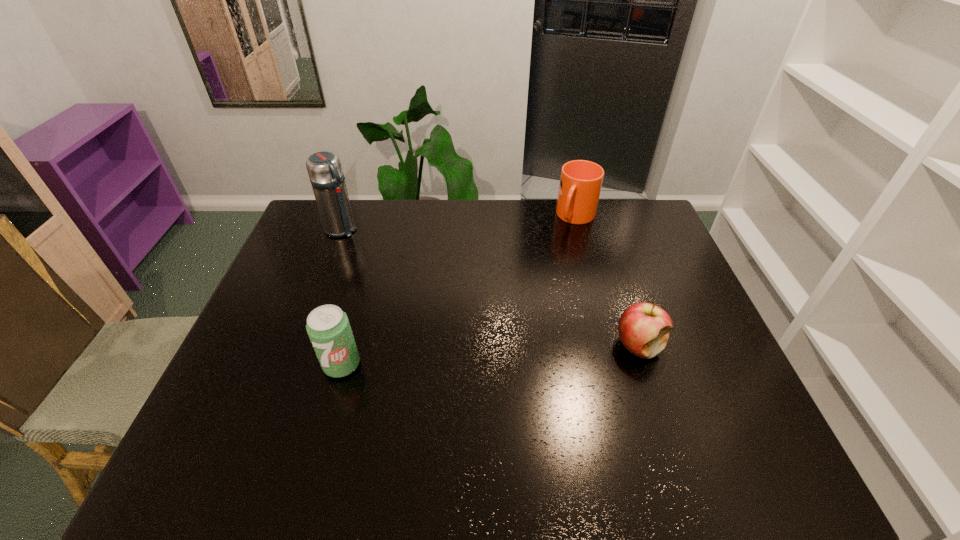
The width and height of the screenshot is (960, 540). What are the coordinates of `soda` in the screenshot? It's located at (328, 327).

Find the location of a particular element. The height and width of the screenshot is (540, 960). apple is located at coordinates (643, 328).

Where is `mug`? This screenshot has height=540, width=960. mug is located at coordinates (580, 185).

Find the location of a particular element. The image size is (960, 540). thermos bottle is located at coordinates (324, 168).

This screenshot has width=960, height=540. What are the coordinates of `the tallest object` in the screenshot? It's located at (324, 168).

Locate an element on the screen. free location located on the right of the soda is located at coordinates (483, 364).

In order to click on vacant area located on the left of the apple in this screenshot , I will do `click(546, 346)`.

What are the coordinates of `free space located 0.340m on the handle side of the mug` in the screenshot? It's located at (540, 295).

In order to click on vacant space located 0.140m on the handle side of the mug in this screenshot , I will do `click(560, 255)`.

Locate an element on the screen. The width and height of the screenshot is (960, 540). free space located 0.200m on the handle side of the mug is located at coordinates (555, 267).